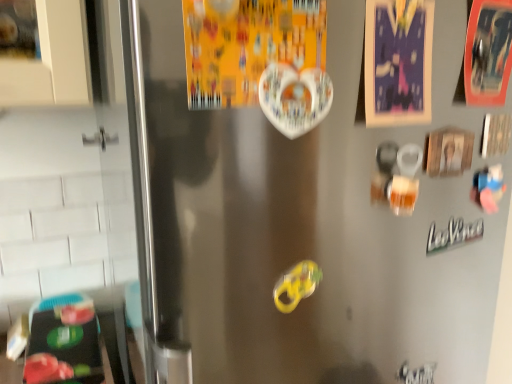
Where is `white glossy heart at upper center, marked as the first postcard in a left-to-right arrangement`? The height and width of the screenshot is (384, 512). white glossy heart at upper center, marked as the first postcard in a left-to-right arrangement is located at coordinates (248, 46).

You are a GUI agent. You are given a task and a screenshot of the screen. Output one action in this format:
    pyautogui.click(x=<x>, y=<y>)
    Task: Click on the orange cardboard postcard at upper right, which is the 3th postcard from left to right
    
    Given the screenshot: What is the action you would take?
    click(x=488, y=52)

What do you see at coordinates (398, 62) in the screenshot? I see `matte paper postcard at upper right, which is the 2th postcard in left-to-right order` at bounding box center [398, 62].

I want to click on white glossy heart at upper center, which is the third postcard in right-to-left order, so click(x=248, y=46).

Is green metallic sticker at lower right facing towards orange cardboard postcard at upper right, the 1th postcard in the right-to-left sequence?

No.

Is point (441, 232) farther from viewer compared to point (487, 78)?

Yes, point (441, 232) is behind point (487, 78).

How far apart are green metallic sticker at lower right and orange cardboard postcard at upper right, the 1th postcard in the right-to-left sequence?

They are 37.27 inches apart.

At what (x,y) coordinates should I click in order to perform the action: click on postcard located on the right of green metallic sticker at lower right. Please return your answer as a coordinate pair (x, y). Looking at the image, I should click on (488, 52).

Is matte paper postcard at upper right, which is the 2th postcard in left-to-right order, at the left side of yellow rubber band at center?

No.

How different are the orientations of matte paper postcard at upper right, placed as the 2th postcard when sorted from right to left, and yellow rubber band at center in degrees?

0.00136 degrees separate the facing orientations of matte paper postcard at upper right, placed as the 2th postcard when sorted from right to left, and yellow rubber band at center.

Is matte paper postcard at upper right, placed as the 2th postcard when sorted from right to left, spatially inside yellow rubber band at center, or outside of it?

matte paper postcard at upper right, placed as the 2th postcard when sorted from right to left, is not inside yellow rubber band at center, it's outside.

Considering their positions, is matte paper postcard at upper right, which is the 2th postcard in left-to-right order, located in front of or behind yellow rubber band at center?

Clearly, matte paper postcard at upper right, which is the 2th postcard in left-to-right order, is in front of yellow rubber band at center.

From the image's perspective, would you say green metallic sticker at lower right is positioned over yellow rubber band at center?

Yes, from the image's perspective, green metallic sticker at lower right is over yellow rubber band at center.

Is green metallic sticker at lower right spatially inside yellow rubber band at center, or outside of it?

green metallic sticker at lower right lies outside yellow rubber band at center.

Does green metallic sticker at lower right come in front of yellow rubber band at center?

No, it is not.

Does green metallic sticker at lower right have a greater width compared to yellow rubber band at center?

Yes.

Is white glossy heart at upper center, which is the third postcard in right-to-left order, at the back of orange cardboard postcard at upper right, which is the 3th postcard from left to right?

No, white glossy heart at upper center, which is the third postcard in right-to-left order, is not at the back of orange cardboard postcard at upper right, which is the 3th postcard from left to right.

From a real-world perspective, is orange cardboard postcard at upper right, which is the 3th postcard from left to right, located beneath white glossy heart at upper center, which is the third postcard in right-to-left order?

No, from a real-world perspective, orange cardboard postcard at upper right, which is the 3th postcard from left to right, is not under white glossy heart at upper center, which is the third postcard in right-to-left order.

Does orange cardboard postcard at upper right, which is the 3th postcard from left to right, have a smaller size compared to white glossy heart at upper center, marked as the first postcard in a left-to-right arrangement?

Indeed, orange cardboard postcard at upper right, which is the 3th postcard from left to right, has a smaller size compared to white glossy heart at upper center, marked as the first postcard in a left-to-right arrangement.

From the image's perspective, between orange cardboard postcard at upper right, which is the 3th postcard from left to right, and white glossy heart at upper center, which is the third postcard in right-to-left order, which one is located above?

orange cardboard postcard at upper right, which is the 3th postcard from left to right, from the image's perspective.

Choose the correct answer: Is yellow rubber band at center inside orange cardboard postcard at upper right, which is the 3th postcard from left to right, or outside it?

yellow rubber band at center cannot be found inside orange cardboard postcard at upper right, which is the 3th postcard from left to right.

Is yellow rubber band at center next to orange cardboard postcard at upper right, which is the 3th postcard from left to right?

No, yellow rubber band at center is not in contact with orange cardboard postcard at upper right, which is the 3th postcard from left to right.

From the image's perspective, which is above, yellow rubber band at center or orange cardboard postcard at upper right, the 1th postcard in the right-to-left sequence?

orange cardboard postcard at upper right, the 1th postcard in the right-to-left sequence, from the image's perspective.

From the image's perspective, starting from the yellow rubber band at center, which postcard is the 3rd one above? Please provide its 2D coordinates.

[(488, 52)]

Is white glossy heart at upper center, which is the third postcard in right-to-left order, positioned far away from matte paper postcard at upper right, placed as the 2th postcard when sorted from right to left?

No, white glossy heart at upper center, which is the third postcard in right-to-left order, is in close proximity to matte paper postcard at upper right, placed as the 2th postcard when sorted from right to left.

Is white glossy heart at upper center, marked as the first postcard in a left-to-right arrangement, inside or outside of matte paper postcard at upper right, which is the 2th postcard in left-to-right order?

The correct answer is: outside.

In the image, there is a matte paper postcard at upper right, which is the 2th postcard in left-to-right order. What are the coordinates of `postcard below it (from a real-world perspective)` in the screenshot? It's located at (248, 46).

Is white glossy heart at upper center, which is the third postcard in right-to-left order, positioned with its back to matte paper postcard at upper right, which is the 2th postcard in left-to-right order?

white glossy heart at upper center, which is the third postcard in right-to-left order, is not turned away from matte paper postcard at upper right, which is the 2th postcard in left-to-right order.

Who is shorter, matte paper postcard at upper right, placed as the 2th postcard when sorted from right to left, or green metallic sticker at lower right?

Standing shorter between the two is green metallic sticker at lower right.

Which is behind, point (408, 59) or point (448, 236)?

The point (448, 236) is behind.

Is matte paper postcard at upper right, placed as the 2th postcard when sorted from right to left, not near green metallic sticker at lower right?

matte paper postcard at upper right, placed as the 2th postcard when sorted from right to left, is positioned a significant distance from green metallic sticker at lower right.

In order to click on writing on the left side of orange cardboard postcard at upper right, which is the 3th postcard from left to right in this screenshot , I will do `click(453, 234)`.

Locate an element on the screen. Image resolution: width=512 pixels, height=384 pixels. food that appears below the matte paper postcard at upper right, placed as the 2th postcard when sorted from right to left (from a real-world perspective) is located at coordinates (297, 285).

Based on the photo, when comparing their distances from yellow rubber band at center, does orange cardboard postcard at upper right, which is the 3th postcard from left to right, or matte paper postcard at upper right, which is the 2th postcard in left-to-right order, seem further?

orange cardboard postcard at upper right, which is the 3th postcard from left to right, lies further to yellow rubber band at center than the other object.

Looking at the image, which one is located further to matte paper postcard at upper right, which is the 2th postcard in left-to-right order, yellow rubber band at center or green metallic sticker at lower right?

Based on the image, green metallic sticker at lower right appears to be further to matte paper postcard at upper right, which is the 2th postcard in left-to-right order.

Estimate the real-world distances between objects in this image. Which object is further from green metallic sticker at lower right, orange cardboard postcard at upper right, which is the 3th postcard from left to right, or white glossy heart at upper center, which is the third postcard in right-to-left order?

white glossy heart at upper center, which is the third postcard in right-to-left order, lies further to green metallic sticker at lower right than the other object.

Estimate the real-world distances between objects in this image. Which object is closer to white glossy heart at upper center, marked as the first postcard in a left-to-right arrangement, orange cardboard postcard at upper right, the 1th postcard in the right-to-left sequence, or yellow rubber band at center?

The object closer to white glossy heart at upper center, marked as the first postcard in a left-to-right arrangement, is yellow rubber band at center.

Looking at the image, which one is located closer to yellow rubber band at center, white glossy heart at upper center, which is the third postcard in right-to-left order, or matte paper postcard at upper right, placed as the 2th postcard when sorted from right to left?

white glossy heart at upper center, which is the third postcard in right-to-left order.

When comparing their distances from matte paper postcard at upper right, which is the 2th postcard in left-to-right order, does white glossy heart at upper center, which is the third postcard in right-to-left order, or green metallic sticker at lower right seem further?

green metallic sticker at lower right lies further to matte paper postcard at upper right, which is the 2th postcard in left-to-right order, than the other object.

Considering their positions, is orange cardboard postcard at upper right, which is the 3th postcard from left to right, positioned closer to matte paper postcard at upper right, which is the 2th postcard in left-to-right order, than yellow rubber band at center?

orange cardboard postcard at upper right, which is the 3th postcard from left to right.

Considering their positions, is yellow rubber band at center positioned closer to matte paper postcard at upper right, which is the 2th postcard in left-to-right order, than orange cardboard postcard at upper right, which is the 3th postcard from left to right?

orange cardboard postcard at upper right, which is the 3th postcard from left to right, is closer to matte paper postcard at upper right, which is the 2th postcard in left-to-right order.

Find the location of `postcard between white glossy heart at upper center, which is the third postcard in right-to-left order, and orange cardboard postcard at upper right, which is the 3th postcard from left to right`. postcard between white glossy heart at upper center, which is the third postcard in right-to-left order, and orange cardboard postcard at upper right, which is the 3th postcard from left to right is located at coordinates (398, 62).

Identify the location of writing located between white glossy heart at upper center, which is the third postcard in right-to-left order, and orange cardboard postcard at upper right, the 1th postcard in the right-to-left sequence, in the left-right direction. (453, 234).

This screenshot has width=512, height=384. I want to click on postcard located between white glossy heart at upper center, which is the third postcard in right-to-left order, and green metallic sticker at lower right in the left-right direction, so click(398, 62).

Where is `writing that lies between orange cardboard postcard at upper right, which is the 3th postcard from left to right, and yellow rubber band at center from top to bottom`? This screenshot has height=384, width=512. writing that lies between orange cardboard postcard at upper right, which is the 3th postcard from left to right, and yellow rubber band at center from top to bottom is located at coordinates (453, 234).